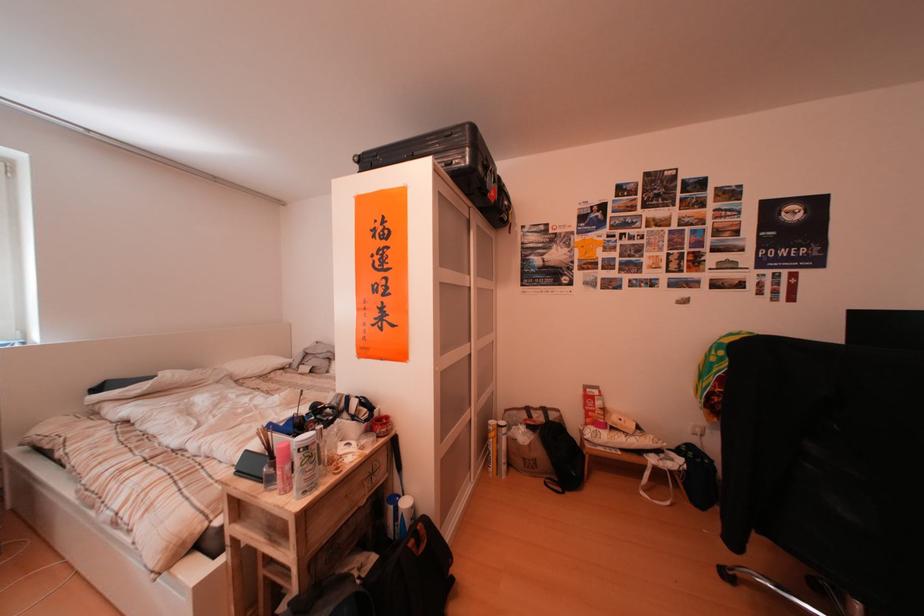
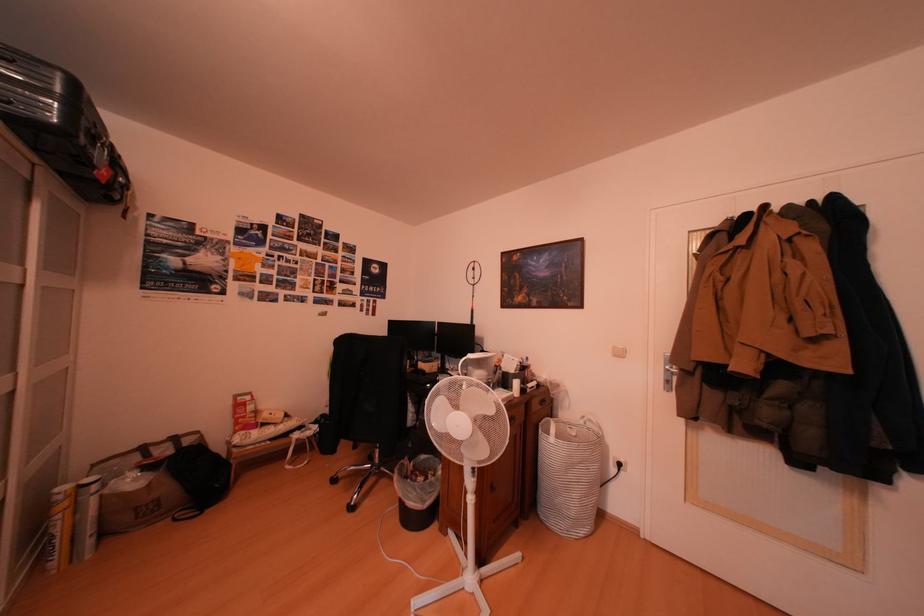
Find the pixel in the second image that matches pixel 553 418 in the first image.

(180, 450)